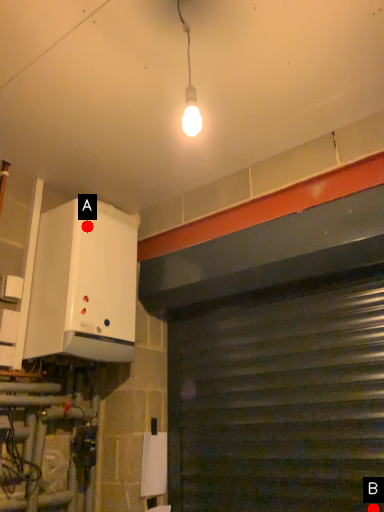
Question: Two points are circled on the image, labeled by A and B beside each circle. Which point is closer to the camera?

Choices:
 (A) A is closer
 (B) B is closer

Answer: (B)